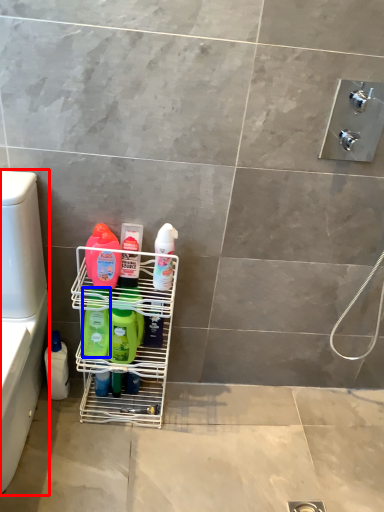
Question: Which of the following is the closest to the observer, washer (highlighted by a red box) or cleaning product (highlighted by a blue box)?

Choices:
 (A) washer
 (B) cleaning product

Answer: (A)